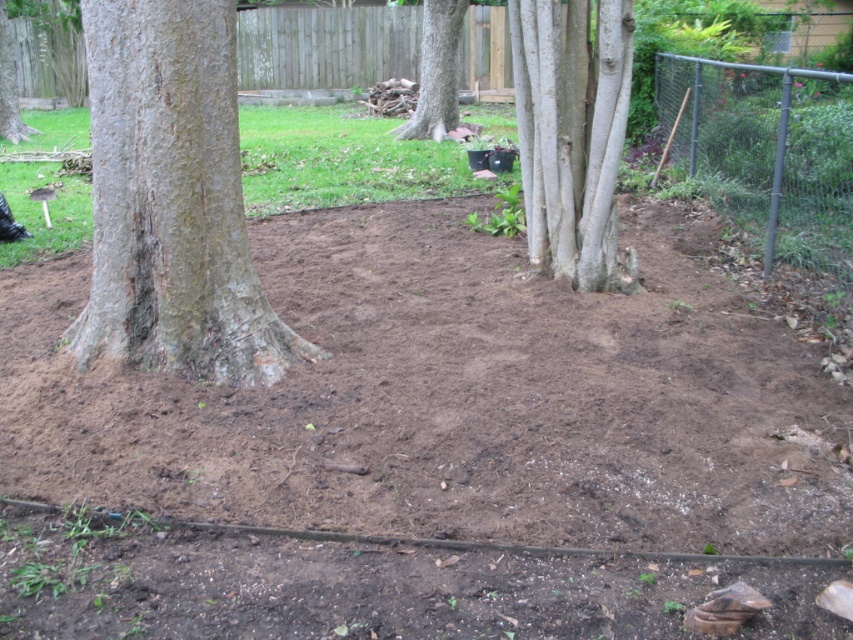
From the picture: Can you confirm if metallic chain-link fence at upper right is positioned below smooth gray bark at center?

No.

Which is below, metallic chain-link fence at upper right or smooth gray bark at center?

smooth gray bark at center

Where is `metallic chain-link fence at upper right`? This screenshot has height=640, width=853. metallic chain-link fence at upper right is located at coordinates (769, 150).

Locate an element on the screen. The image size is (853, 640). metallic chain-link fence at upper right is located at coordinates (769, 150).

Can you confirm if smooth gray bark at center is positioned to the left of brown rough bark tree at left?

No, smooth gray bark at center is not to the left of brown rough bark tree at left.

Is point (564, 179) positioned before point (25, 138)?

Yes, it is in front of point (25, 138).

This screenshot has height=640, width=853. Identify the location of smooth gray bark at center. (572, 136).

In order to click on smooth gray bark at center in this screenshot , I will do `click(572, 136)`.

Consider the image. Does smooth gray bark at center appear over brown rough tree at center?

No.

Is point (560, 76) positioned before point (431, 138)?

That is True.

Find the location of a particular element. The height and width of the screenshot is (640, 853). smooth gray bark at center is located at coordinates (572, 136).